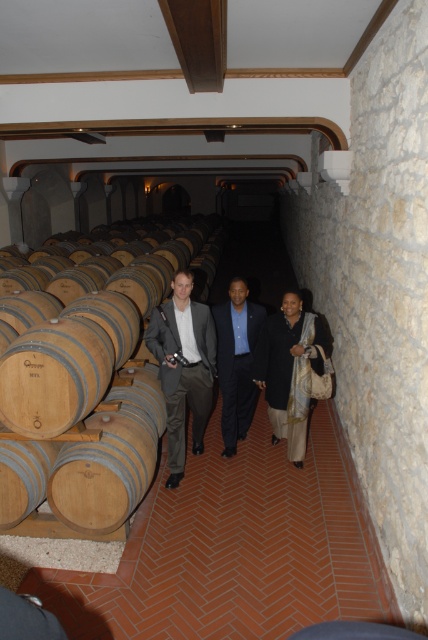
Between wooden barrel at left and matte gray suit at center, which one appears on the left side from the viewer's perspective?

wooden barrel at left

Can you confirm if wooden barrel at left is thinner than matte gray suit at center?

No.

Is point (11, 342) more distant than point (208, 412)?

No, it is not.

Identify the location of wooden barrel at left. The width and height of the screenshot is (428, 640). (83, 333).

Based on the photo, can you confirm if dark blue fabric dress at center is positioned above dark blue suit at center?

Incorrect, dark blue fabric dress at center is not positioned above dark blue suit at center.

Is dark blue fabric dress at center shorter than dark blue suit at center?

Yes, dark blue fabric dress at center is shorter than dark blue suit at center.

Who is more forward, (276,419) or (225,454)?

Point (276,419) is in front.

Where is `dark blue fabric dress at center`? dark blue fabric dress at center is located at coordinates (290, 371).

Who is positioned more to the left, matte gray suit at center or dark blue suit at center?

From the viewer's perspective, matte gray suit at center appears more on the left side.

Is matte gray suit at center taller than dark blue suit at center?

Yes.

Identify the location of matte gray suit at center. (184, 368).